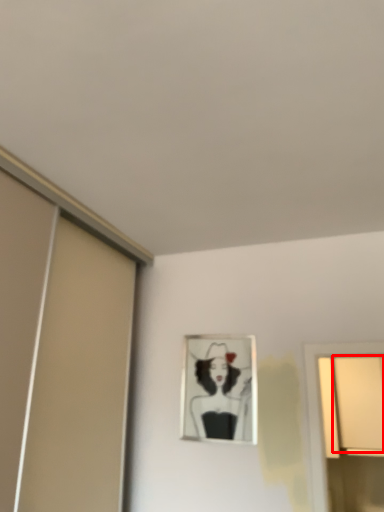
Question: Considering the relative positions of window (annotated by the red box) and picture frame in the image provided, where is window (annotated by the red box) located with respect to the staircase?

Choices:
 (A) left
 (B) right

Answer: (B)